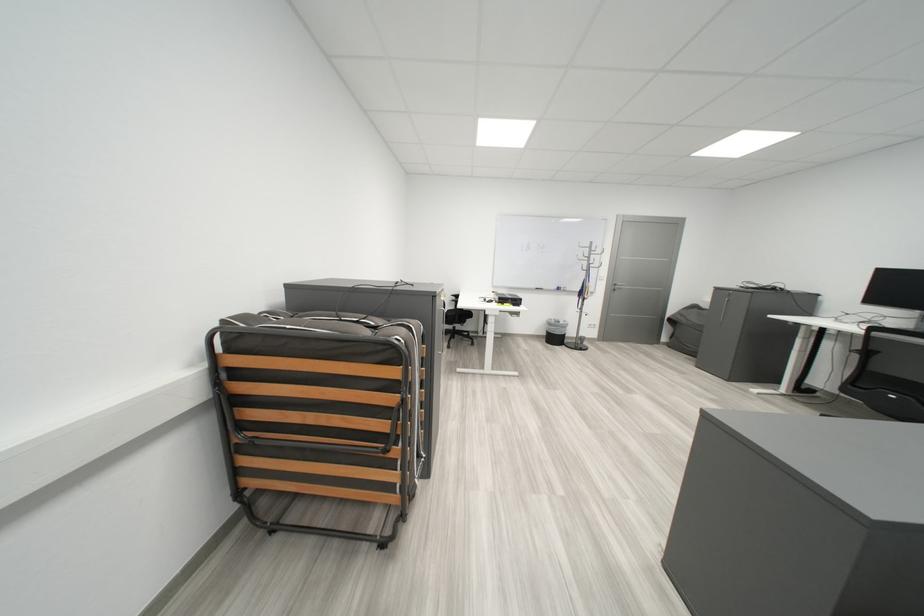
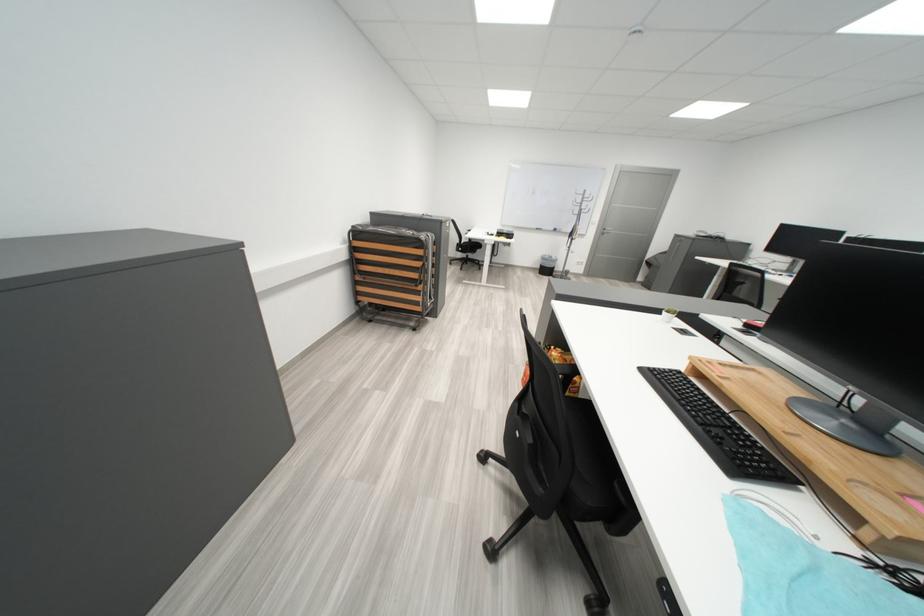
Where in the second image is the point corresponding to (x=558, y=336) from the first image?

(552, 269)